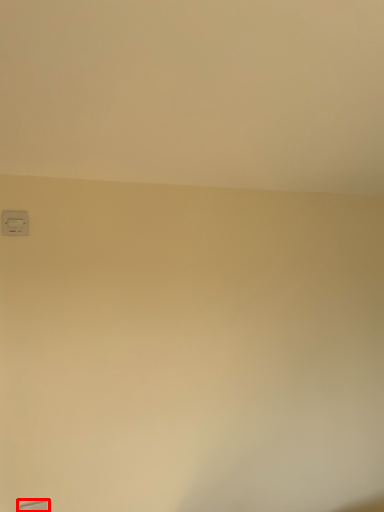
Question: Considering the relative positions of window (annotated by the red box) and light switch in the image provided, where is window (annotated by the red box) located with respect to the staircase?

Choices:
 (A) right
 (B) left

Answer: (A)